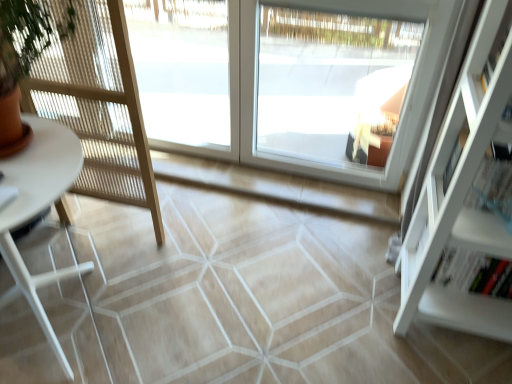
Locate an element on the screen. vacant area to the right of white glossy table at left is located at coordinates (186, 311).